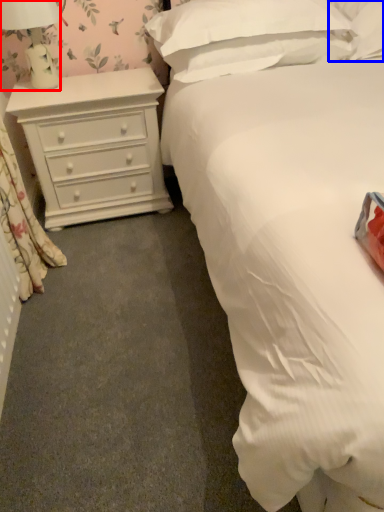
Question: Which object is closer to the camera taking this photo, lamp (highlighted by a red box) or pillow (highlighted by a blue box)?

Choices:
 (A) lamp
 (B) pillow

Answer: (A)